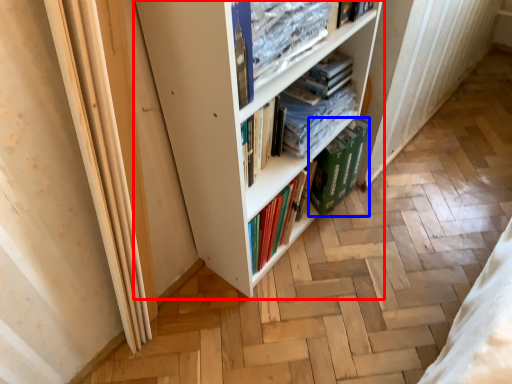
Question: Which of the following is the farthest to the observer, bookcase (highlighted by a red box) or paperback book (highlighted by a blue box)?

Choices:
 (A) bookcase
 (B) paperback book

Answer: (B)